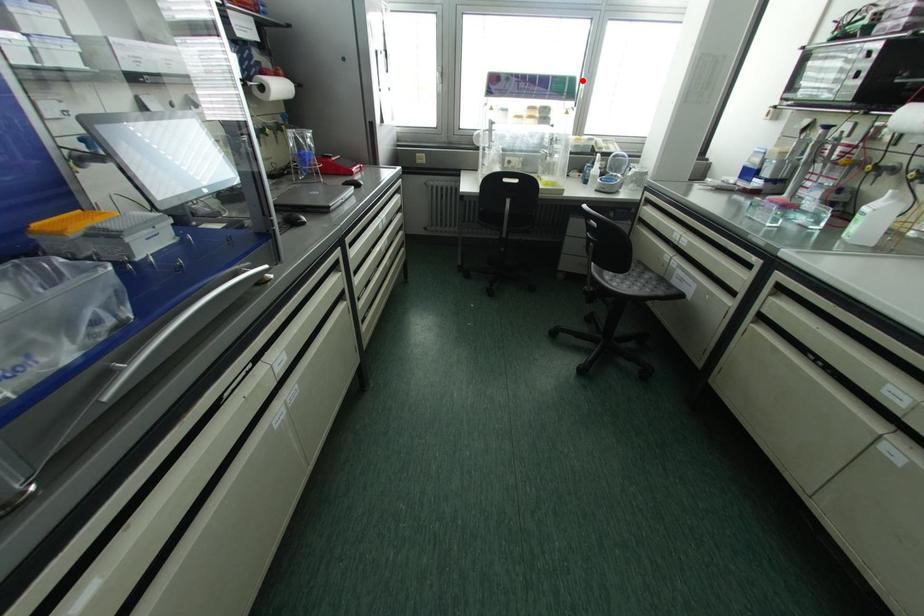
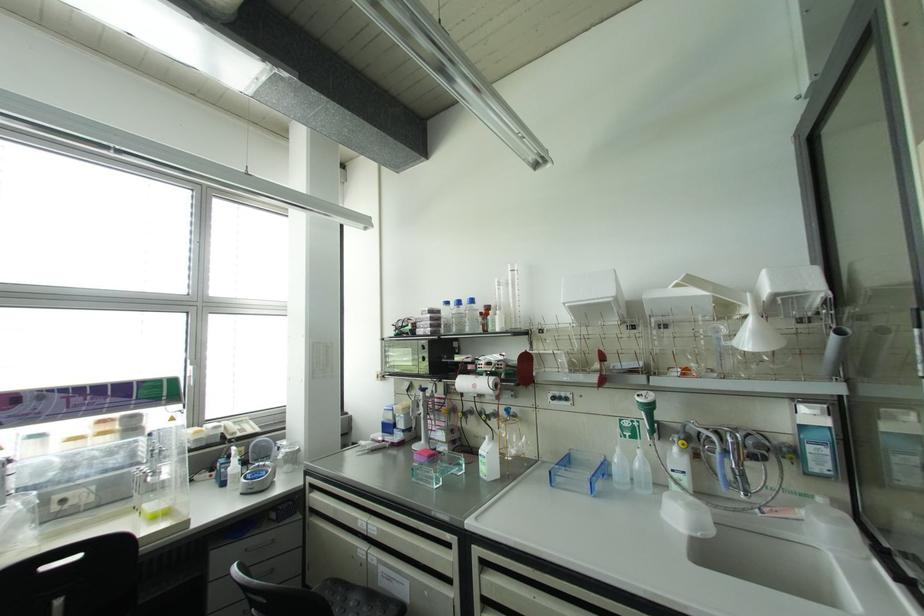
Question: I am providing you with two images of the same scene from different viewpoints. A red point is shown in image1. For the corresponding object point in image2, is it positioned nearer or farther from the camera?

Choices:
 (A) Nearer
 (B) Farther

Answer: (B)